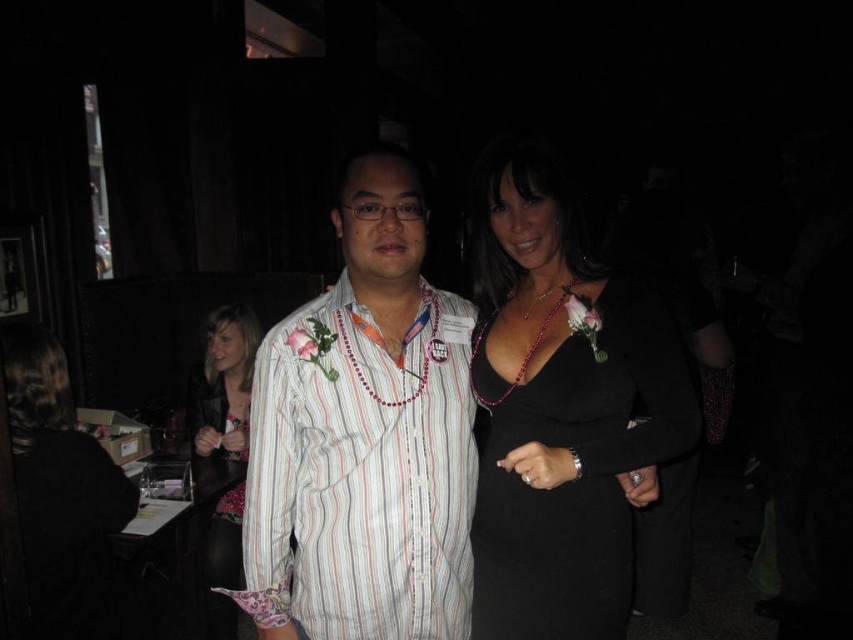
Is the position of black satin dress at center more distant than that of black leather ring at center?

That is True.

This screenshot has width=853, height=640. I want to click on black satin dress at center, so click(x=563, y=406).

Which of these two, black satin dress at center or floral dress at center, stands taller?

Standing taller between the two is floral dress at center.

Which is below, black satin dress at center or floral dress at center?

floral dress at center

Between point (582, 337) and point (230, 544), which one is positioned in front?

Positioned in front is point (582, 337).

Find the location of a particular element. Image resolution: width=853 pixels, height=640 pixels. black satin dress at center is located at coordinates (563, 406).

Describe the element at coordinates (563, 406) in the screenshot. I see `black satin dress at center` at that location.

Who is more distant from viewer, [534,202] or [4,390]?

Point [4,390]

Between point (624, 460) and point (44, 426), which one is positioned behind?

The point (44, 426) is more distant.

This screenshot has width=853, height=640. Identify the location of black satin dress at center. (563, 406).